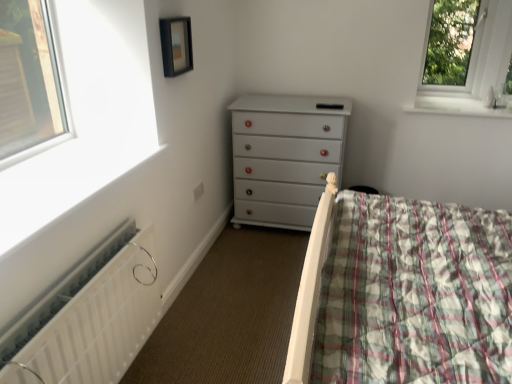
Question: Is transparent glass window at upper right not within white glossy window sill at upper right?

Choices:
 (A) yes
 (B) no

Answer: (A)

Question: Can you confirm if transparent glass window at upper right is positioned to the left of white glossy window sill at upper right?

Choices:
 (A) yes
 (B) no

Answer: (B)

Question: From the image's perspective, does transparent glass window at upper right appear higher than white glossy window sill at upper right?

Choices:
 (A) yes
 (B) no

Answer: (A)

Question: Is transparent glass window at upper right smaller than white glossy window sill at upper right?

Choices:
 (A) yes
 (B) no

Answer: (B)

Question: Is transparent glass window at upper right taller than white glossy window sill at upper right?

Choices:
 (A) yes
 (B) no

Answer: (A)

Question: From the image's perspective, is white matte radiator at lower left positioned above or below matte black picture frame at upper center?

Choices:
 (A) below
 (B) above

Answer: (A)

Question: Is white matte radiator at lower left bigger or smaller than matte black picture frame at upper center?

Choices:
 (A) big
 (B) small

Answer: (A)

Question: In the image, is white matte radiator at lower left positioned in front of or behind matte black picture frame at upper center?

Choices:
 (A) behind
 (B) front

Answer: (B)

Question: Is white matte radiator at lower left to the left or to the right of matte black picture frame at upper center in the image?

Choices:
 (A) right
 (B) left

Answer: (B)

Question: Is white matte radiator at lower left inside the boundaries of white painted wood chest of drawers at center, or outside?

Choices:
 (A) outside
 (B) inside

Answer: (A)

Question: Relative to white painted wood chest of drawers at center, is white matte radiator at lower left in front or behind?

Choices:
 (A) front
 (B) behind

Answer: (A)

Question: Is white matte radiator at lower left taller or shorter than white painted wood chest of drawers at center?

Choices:
 (A) short
 (B) tall

Answer: (A)

Question: From the image's perspective, is white matte radiator at lower left positioned above or below white painted wood chest of drawers at center?

Choices:
 (A) above
 (B) below

Answer: (B)

Question: Is transparent glass window at upper right situated inside matte black picture frame at upper center or outside?

Choices:
 (A) outside
 (B) inside

Answer: (A)

Question: Is point (458, 33) closer or farther from the camera than point (170, 64)?

Choices:
 (A) farther
 (B) closer

Answer: (A)